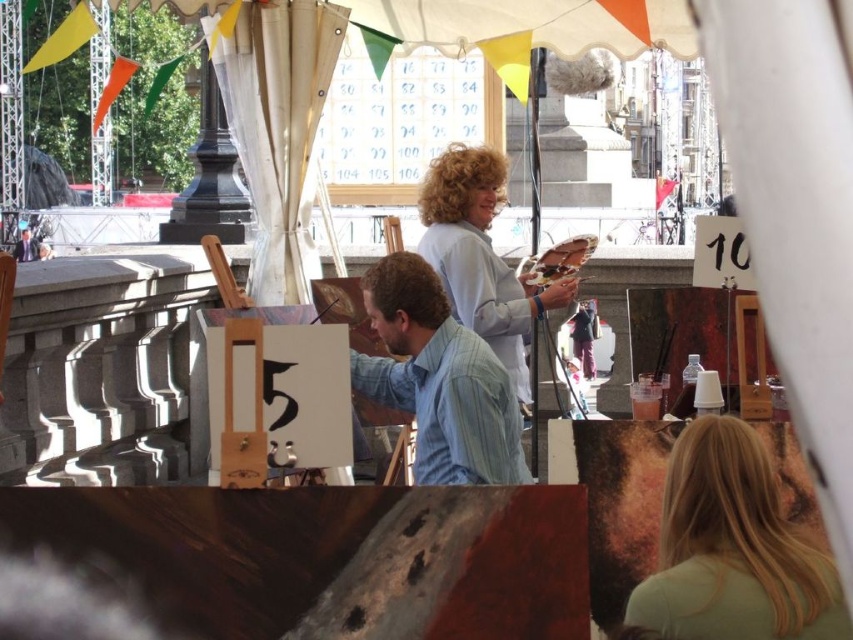
Question: Is light blue striped shirt at center to the right of light blue fabric at center from the viewer's perspective?

Choices:
 (A) no
 (B) yes

Answer: (A)

Question: Is light blue striped shirt at center bigger than light blue fabric at center?

Choices:
 (A) yes
 (B) no

Answer: (B)

Question: Estimate the real-world distances between objects in this image. Which object is farther from the blonde hair at upper right?

Choices:
 (A) light blue fabric at center
 (B) light blue striped shirt at center

Answer: (A)

Question: Which point is farther to the camera?

Choices:
 (A) blonde hair at upper right
 (B) light blue striped shirt at center

Answer: (B)

Question: Based on their relative distances, which object is nearer to the light blue striped shirt at center?

Choices:
 (A) light blue fabric at center
 (B) blonde hair at upper right

Answer: (A)

Question: Considering the relative positions of light blue striped shirt at center and light blue fabric at center in the image provided, where is light blue striped shirt at center located with respect to light blue fabric at center?

Choices:
 (A) above
 (B) below

Answer: (B)